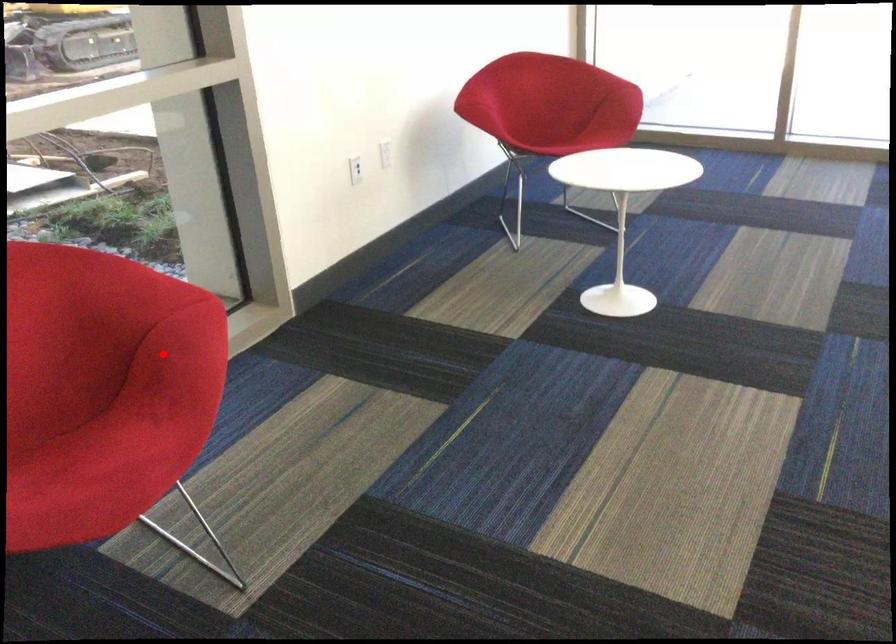
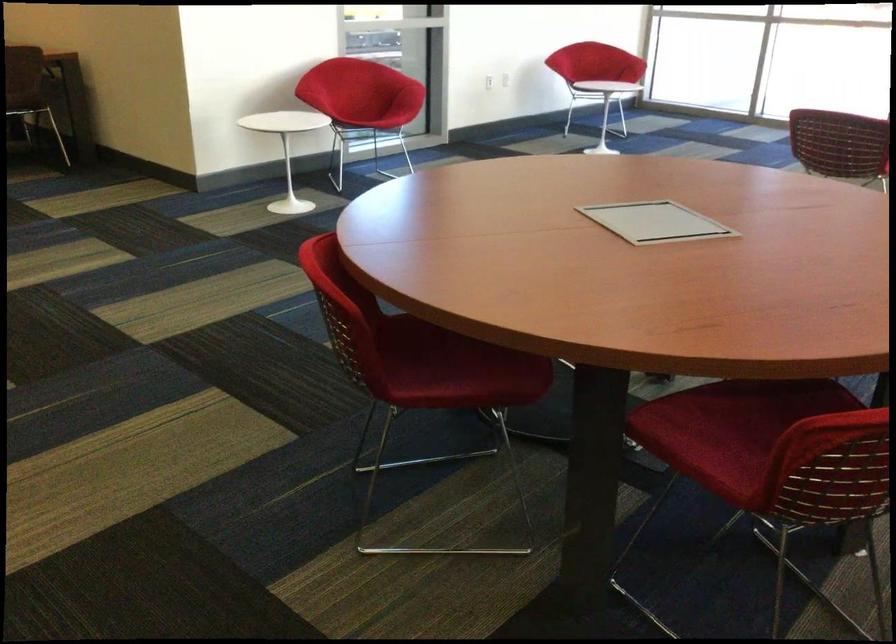
Where in the second image is the point corresponding to the highlighted location from the first image?

(406, 87)